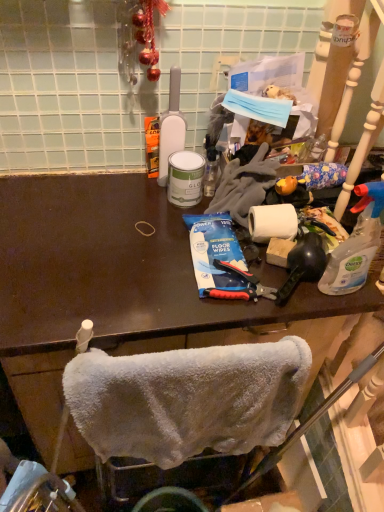
Image resolution: width=384 pixels, height=512 pixels. What do you see at coordinates (187, 399) in the screenshot? I see `white fluffy towel at lower center` at bounding box center [187, 399].

Measure the distance between point (198, 251) and camera.

The distance of point (198, 251) from camera is 39.13 inches.

This screenshot has width=384, height=512. Describe the element at coordinates (356, 244) in the screenshot. I see `clear plastic spray bottle at right, which appears as the 2th bottle when viewed from the top` at that location.

What is the approximate width of clear plastic spray bottle at right, which is the 1th bottle from right to left?

2.70 inches.

Where is `white fluffy towel at lower center`? Image resolution: width=384 pixels, height=512 pixels. white fluffy towel at lower center is located at coordinates (187, 399).

Which is correct: white fluffy towel at lower center is inside clear plastic spray bottle at right, the first bottle from the front, or outside of it?

white fluffy towel at lower center is not enclosed by clear plastic spray bottle at right, the first bottle from the front.

Between white fluffy towel at lower center and clear plastic spray bottle at right, which is the 1th bottle from right to left, which one appears on the right side from the viewer's perspective?

clear plastic spray bottle at right, which is the 1th bottle from right to left, is more to the right.

From the image's perspective, would you say white fluffy towel at lower center is shown under clear plastic spray bottle at right, which appears as the 2th bottle when viewed from the top?

Correct, white fluffy towel at lower center appears lower than clear plastic spray bottle at right, which appears as the 2th bottle when viewed from the top, in the image.

Is point (80, 364) more distant than point (366, 276)?

That is False.

From the image's perspective, which is below, clear plastic spray bottle at right, acting as the 2th bottle starting from the left, or white fluffy towel at lower center?

white fluffy towel at lower center.

Looking at their sizes, would you say clear plastic spray bottle at right, acting as the 2th bottle starting from the left, is wider or thinner than white fluffy towel at lower center?

In the image, clear plastic spray bottle at right, acting as the 2th bottle starting from the left, appears to be more narrow than white fluffy towel at lower center.

Does point (334, 267) come closer to viewer compared to point (179, 456)?

Yes, it is in front of point (179, 456).

Who is shorter, clear plastic spray bottle at right, the first bottle from the front, or white fluffy towel at lower center?

clear plastic spray bottle at right, the first bottle from the front.

Can you confirm if blue plastic toothpaste at center is bigger than clear plastic spray bottle at right, which is the 1th bottle from right to left?

No, blue plastic toothpaste at center is not bigger than clear plastic spray bottle at right, which is the 1th bottle from right to left.

Could you tell me if blue plastic toothpaste at center is turned towards clear plastic spray bottle at right, which is the 1th bottle from right to left?

No, blue plastic toothpaste at center is not facing towards clear plastic spray bottle at right, which is the 1th bottle from right to left.

Considering the relative sizes of blue plastic toothpaste at center and clear plastic spray bottle at right, the first bottle from the front, in the image provided, is blue plastic toothpaste at center wider than clear plastic spray bottle at right, the first bottle from the front,?

Yes.

Which object is further away from the camera taking this photo, blue plastic toothpaste at center or clear plastic spray bottle at right, arranged as the 1th bottle when ordered from the bottom?

blue plastic toothpaste at center is further from the camera.

From the picture: Considering the positions of objects clear plastic spray bottle at right, arranged as the 1th bottle when ordered from the bottom, and blue plastic toothpaste at center in the image provided, who is in front, clear plastic spray bottle at right, arranged as the 1th bottle when ordered from the bottom, or blue plastic toothpaste at center?

clear plastic spray bottle at right, arranged as the 1th bottle when ordered from the bottom, is more forward.

You are a GUI agent. You are given a task and a screenshot of the screen. Output one action in this format:
    pyautogui.click(x=<x>, y=<y>)
    Task: Click on the 1st bottle above the blue plastic toothpaste at center (from the image's perspective)
    
    Given the screenshot: What is the action you would take?
    (x=356, y=244)

Looking at this image, who is bigger, clear plastic spray bottle at right, arranged as the 1th bottle when ordered from the bottom, or blue plastic toothpaste at center?

clear plastic spray bottle at right, arranged as the 1th bottle when ordered from the bottom, is bigger.

Could blue plastic toothpaste at center be considered to be inside clear plastic spray bottle at right, arranged as the 1th bottle when ordered from the bottom?

No.

Would you consider clear plastic spray bottle at right, which is the second bottle in back-to-front order, to be distant from white matte bottle at upper center, arranged as the second bottle when viewed from the front?

No, there isn't a large distance between clear plastic spray bottle at right, which is the second bottle in back-to-front order, and white matte bottle at upper center, arranged as the second bottle when viewed from the front.

Where is `bottle on the right of white matte bottle at upper center, placed as the 1th bottle when sorted from left to right`? bottle on the right of white matte bottle at upper center, placed as the 1th bottle when sorted from left to right is located at coordinates (356, 244).

Is clear plastic spray bottle at right, acting as the 2th bottle starting from the left, oriented away from white matte bottle at upper center, placed as the 1th bottle when sorted from left to right?

No, clear plastic spray bottle at right, acting as the 2th bottle starting from the left, is not facing the opposite direction of white matte bottle at upper center, placed as the 1th bottle when sorted from left to right.

Can we say blue plastic toothpaste at center lies outside white fluffy towel at lower center?

Absolutely, blue plastic toothpaste at center is external to white fluffy towel at lower center.

Which object is positioned more to the right, blue plastic toothpaste at center or white fluffy towel at lower center?

From the viewer's perspective, blue plastic toothpaste at center appears more on the right side.

Considering the sizes of objects blue plastic toothpaste at center and white fluffy towel at lower center in the image provided, who is shorter, blue plastic toothpaste at center or white fluffy towel at lower center?

blue plastic toothpaste at center.

Is white fluffy towel at lower center turned away from blue plastic toothpaste at center?

Yes, white fluffy towel at lower center is facing away from blue plastic toothpaste at center.

Considering the positions of objects white fluffy towel at lower center and blue plastic toothpaste at center in the image provided, who is more to the right, white fluffy towel at lower center or blue plastic toothpaste at center?

Positioned to the right is blue plastic toothpaste at center.

Between point (161, 397) and point (225, 285), which one is positioned behind?

The point (225, 285) is farther.

Consider the image. From a real-world perspective, who is located lower, white fluffy towel at lower center or blue plastic toothpaste at center?

In real-world perspective, white fluffy towel at lower center is lower.

Find the location of `towel/napkin below the clear plastic spray bottle at right, which is the second bottle in back-to-front order (from a real-world perspective)`. towel/napkin below the clear plastic spray bottle at right, which is the second bottle in back-to-front order (from a real-world perspective) is located at coordinates click(187, 399).

Find the location of a particular element. The width and height of the screenshot is (384, 512). towel/napkin that is on the left side of clear plastic spray bottle at right, the first bottle from the front is located at coordinates (187, 399).

When comparing their distances from white matte bottle at upper center, arranged as the 1th bottle when viewed from the top, does white fluffy towel at lower center or clear plastic spray bottle at right, which appears as the 2th bottle when viewed from the top, seem further?

The object further to white matte bottle at upper center, arranged as the 1th bottle when viewed from the top, is white fluffy towel at lower center.

Which object lies nearer to the anchor point white fluffy towel at lower center, clear plastic spray bottle at right, which is the 1th bottle from right to left, or white matte bottle at upper center, placed as the 1th bottle when sorted from left to right?

clear plastic spray bottle at right, which is the 1th bottle from right to left, lies closer to white fluffy towel at lower center than the other object.

From the image, which object appears to be farther from white matte bottle at upper center, arranged as the 1th bottle when viewed from the top, blue plastic toothpaste at center or clear plastic spray bottle at right, which appears as the 2th bottle when viewed from the top?

clear plastic spray bottle at right, which appears as the 2th bottle when viewed from the top, lies further to white matte bottle at upper center, arranged as the 1th bottle when viewed from the top, than the other object.

Based on their spatial positions, is white matte bottle at upper center, arranged as the 1th bottle when viewed from the top, or clear plastic spray bottle at right, which appears as the 2th bottle when viewed from the top, closer to white fluffy towel at lower center?

clear plastic spray bottle at right, which appears as the 2th bottle when viewed from the top, lies closer to white fluffy towel at lower center than the other object.

Based on their spatial positions, is white fluffy towel at lower center or white matte bottle at upper center, arranged as the second bottle when viewed from the front, closer to clear plastic spray bottle at right, acting as the 2th bottle starting from the left?

The object closer to clear plastic spray bottle at right, acting as the 2th bottle starting from the left, is white fluffy towel at lower center.

Looking at the image, which one is located further to white matte bottle at upper center, positioned as the first bottle in back-to-front order, white fluffy towel at lower center or blue plastic toothpaste at center?

The object further to white matte bottle at upper center, positioned as the first bottle in back-to-front order, is white fluffy towel at lower center.

Considering their positions, is clear plastic spray bottle at right, the first bottle from the front, positioned closer to white matte bottle at upper center, arranged as the 1th bottle when viewed from the top, than blue plastic toothpaste at center?

blue plastic toothpaste at center.

From the image, which object appears to be farther from clear plastic spray bottle at right, which is the 1th bottle from right to left, white fluffy towel at lower center or blue plastic toothpaste at center?

white fluffy towel at lower center is further to clear plastic spray bottle at right, which is the 1th bottle from right to left.

Where is `bottle between white matte bottle at upper center, which is the 2th bottle in right-to-left order, and white fluffy towel at lower center vertically`? The width and height of the screenshot is (384, 512). bottle between white matte bottle at upper center, which is the 2th bottle in right-to-left order, and white fluffy towel at lower center vertically is located at coordinates (356, 244).

Image resolution: width=384 pixels, height=512 pixels. I want to click on toothpaste between white matte bottle at upper center, which is the 2th bottle in right-to-left order, and clear plastic spray bottle at right, the first bottle from the front, from left to right, so click(215, 252).

At what (x,y) coordinates should I click in order to perform the action: click on toothpaste between white matte bottle at upper center, arranged as the 1th bottle when viewed from the top, and white fluffy towel at lower center in the up-down direction. Please return your answer as a coordinate pair (x, y). This screenshot has height=512, width=384. Looking at the image, I should click on (215, 252).

This screenshot has height=512, width=384. I want to click on toothpaste that lies between clear plastic spray bottle at right, arranged as the 1th bottle when ordered from the bottom, and white fluffy towel at lower center from top to bottom, so click(x=215, y=252).